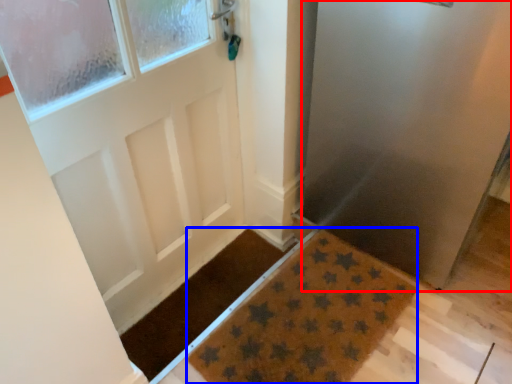
Question: Which object is closer to the camera taking this photo, screen door (highlighted by a red box) or doormat (highlighted by a blue box)?

Choices:
 (A) screen door
 (B) doormat

Answer: (A)